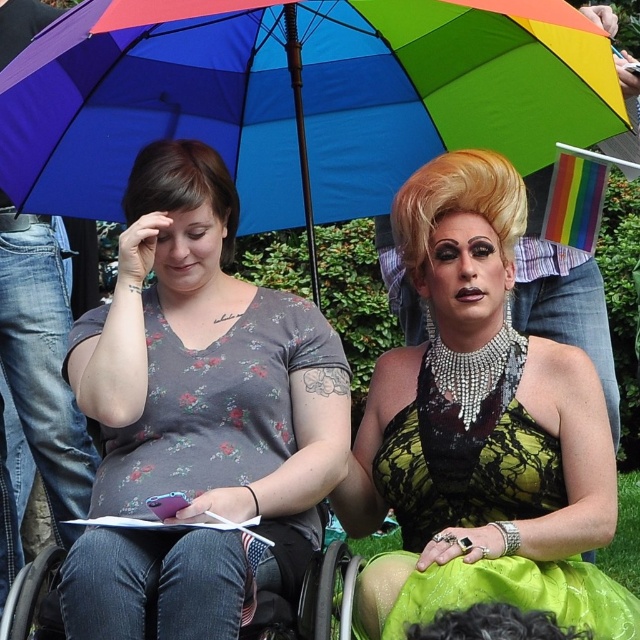
Question: Which object is positioned closest to the rainbow fabric umbrella at upper center?

Choices:
 (A) green satin dress at center
 (B) black plastic wheelchair at lower center
 (C) floral printed shirt at center

Answer: (C)

Question: Can you confirm if green satin dress at center is positioned to the left of black plastic wheelchair at lower center?

Choices:
 (A) no
 (B) yes

Answer: (A)

Question: Is green satin dress at center below black plastic wheelchair at lower center?

Choices:
 (A) yes
 (B) no

Answer: (B)

Question: Is the position of rainbow fabric umbrella at upper center less distant than that of black plastic wheelchair at lower center?

Choices:
 (A) no
 (B) yes

Answer: (B)

Question: Which point is closer to the camera taking this photo?

Choices:
 (A) (17, 621)
 (B) (518, 420)
 (C) (353, 186)
 (D) (212, 314)

Answer: (A)

Question: Which point is closer to the camera?

Choices:
 (A) rainbow fabric umbrella at upper center
 (B) black plastic wheelchair at lower center

Answer: (A)